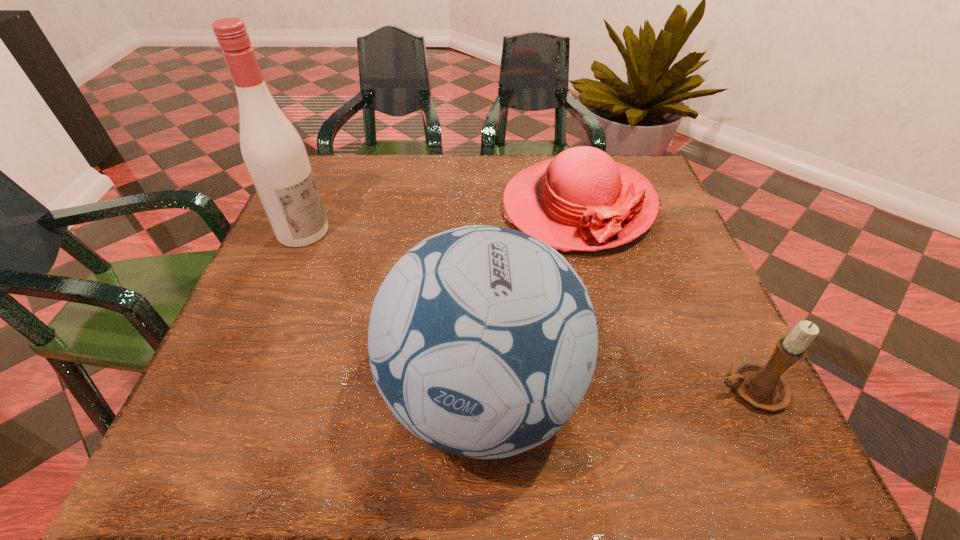
You are a GUI agent. You are given a task and a screenshot of the screen. Output one action in this format:
    pyautogui.click(x=<x>, y=<y>)
    Task: Click on the free space on the desktop that is between the second tallest object and the third tallest object and is positioned at the front of the shortest object with a bow
    This screenshot has width=960, height=540.
    Given the screenshot: What is the action you would take?
    pyautogui.click(x=627, y=392)

The image size is (960, 540). What are the coordinates of `free space on the desktop that is between the soccer ball and the candle holder and is positioned on the label of the leftmost object` in the screenshot? It's located at (603, 393).